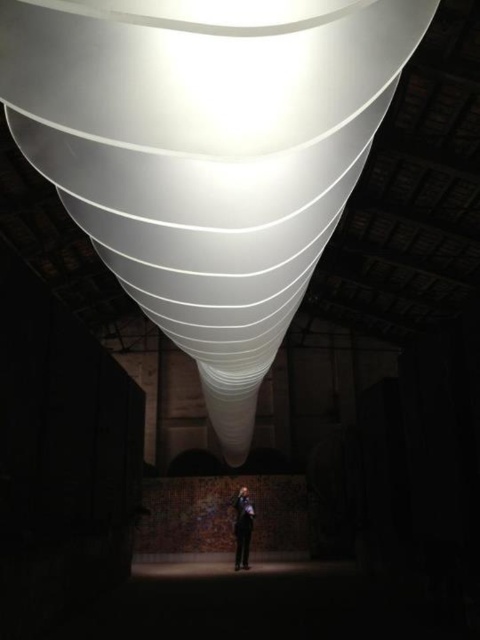
You are an architect analyzing the structural integrity of the white glossy cone at center. You have a sensor that can measure stress at any point on the cone. If you place the sensor at point (206, 154), will it be on the cone?

Yes, the point (206, 154) is on the white glossy cone at center.

You are a photographer standing in the industrial space. You need to position yourself so that both the white glossy cone at center and the black suit at center are visible in your frame. Considering their sizes, which object should you focus on to ensure both fit in the photo?

The white glossy cone at center is larger than the black suit at center. To ensure both fit in the photo, focus on the white glossy cone at center since it takes up more space, allowing the smaller black suit at center to be included in the frame as well.

You are standing in the industrial space and want to place a new decorative light at the exact center of the white glossy cone at center. According to the coordinates provided, where should you position the light?

The white glossy cone at center is located at point coordinates (206,154), so you should position the light at those coordinates to place it at the exact center of the white glossy cone at center.